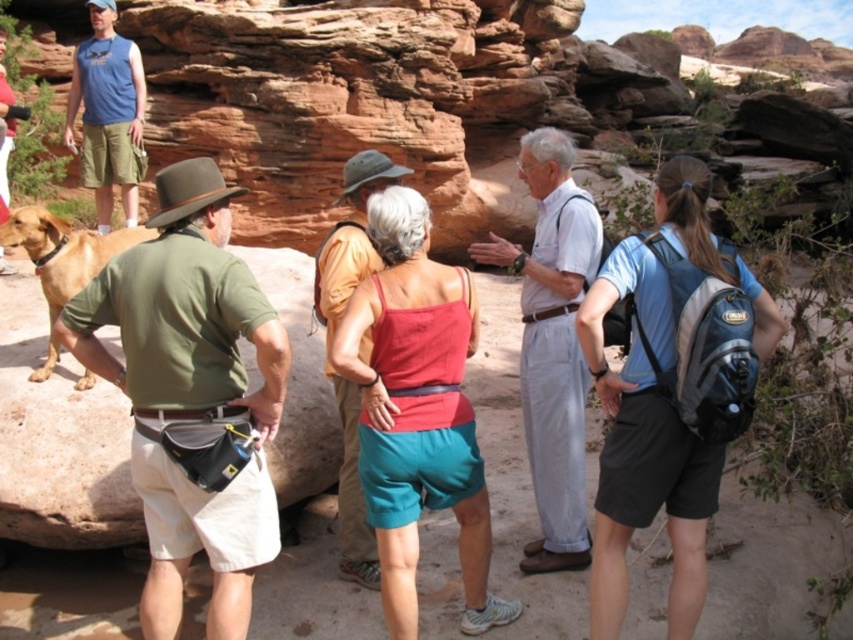
What do you see at coordinates (331, 342) in the screenshot? I see `reddish-brown fabric tank top at center` at bounding box center [331, 342].

Which is above, reddish-brown fabric tank top at center or golden brown fur at left?

reddish-brown fabric tank top at center

Does point (347, 225) lie in front of point (88, 264)?

No, (347, 225) is behind (88, 264).

Image resolution: width=853 pixels, height=640 pixels. Find the location of `reddish-brown fabric tank top at center`. reddish-brown fabric tank top at center is located at coordinates (331, 342).

The image size is (853, 640). What do you see at coordinates (643, 449) in the screenshot? I see `blue fabric backpack at center-right` at bounding box center [643, 449].

Is blue fabric backpack at center-right to the left of white cotton shirt at center from the viewer's perspective?

In fact, blue fabric backpack at center-right is to the right of white cotton shirt at center.

Does point (770, 310) come farther from viewer compared to point (581, 486)?

No, it is in front of (581, 486).

Find the location of a particular element. blue fabric backpack at center-right is located at coordinates (643, 449).

Can you confirm if matte red tank top at center is wider than golden brown fur at left?

Indeed, matte red tank top at center has a greater width compared to golden brown fur at left.

Between matte red tank top at center and golden brown fur at left, which one appears on the left side from the viewer's perspective?

golden brown fur at left is more to the left.

Does point (405, 483) lie in front of point (59, 288)?

That is True.

Locate an element on the screen. matte red tank top at center is located at coordinates (416, 410).